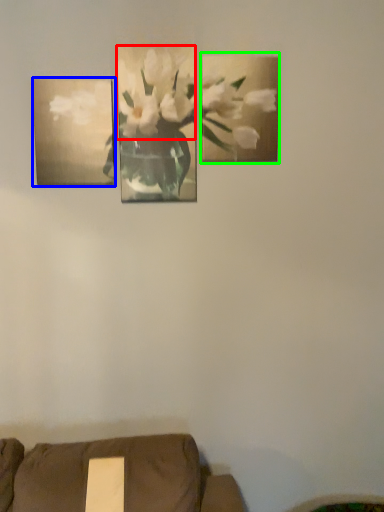
Question: Considering the real-world distances, which object is farthest from flower (highlighted by a red box)? picture frame (highlighted by a blue box) or picture frame (highlighted by a green box)?

Choices:
 (A) picture frame
 (B) picture frame

Answer: (A)